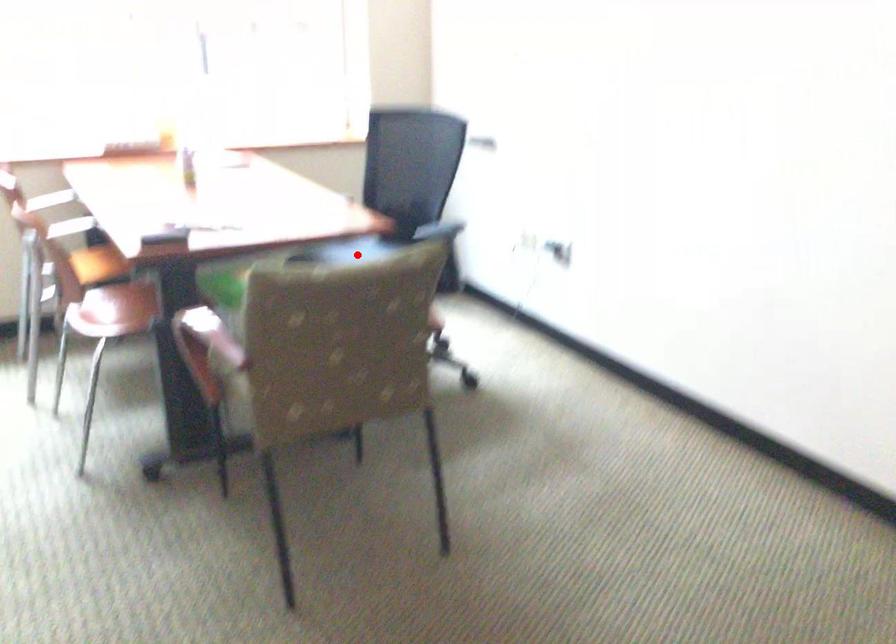
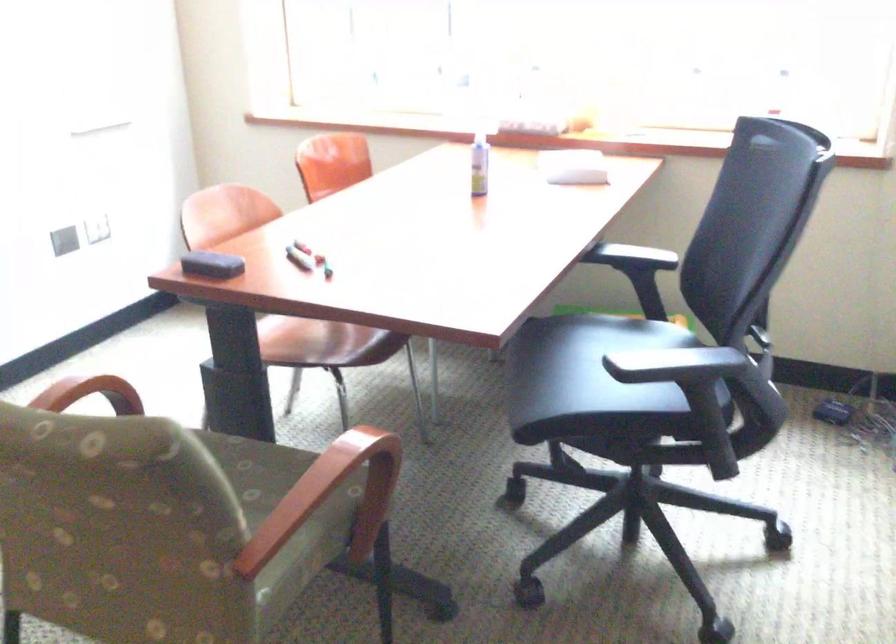
Question: I am providing you with two images of the same scene from different viewpoints. In image1, a red point is highlighted. Considering the same 3D point in image2, which of the following is correct?

Choices:
 (A) It is closer
 (B) It is farther

Answer: (A)